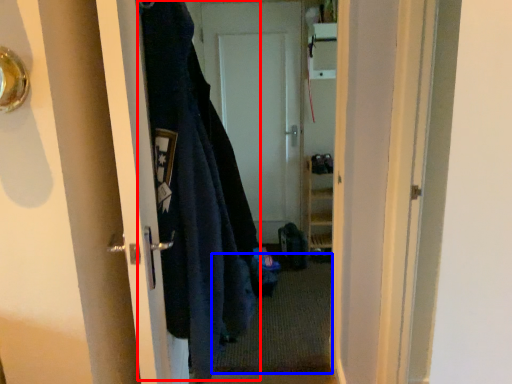
Question: Which of the following is the farthest to the observer, garment (highlighted by a red box) or doormat (highlighted by a blue box)?

Choices:
 (A) garment
 (B) doormat

Answer: (B)